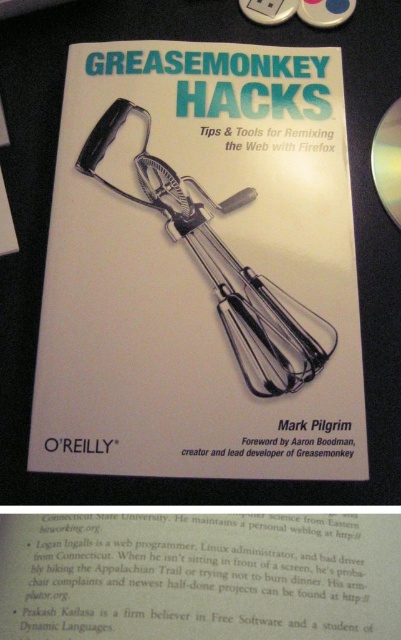
Question: Is white paper book at center further to camera compared to silver metallic dvd at upper right?

Choices:
 (A) no
 (B) yes

Answer: (A)

Question: Is white paper book at center to the right of silver metallic dvd at upper right from the viewer's perspective?

Choices:
 (A) no
 (B) yes

Answer: (A)

Question: Considering the relative positions of white paper book at center and silver metallic dvd at upper right in the image provided, where is white paper book at center located with respect to silver metallic dvd at upper right?

Choices:
 (A) below
 (B) above

Answer: (A)

Question: Among these points, which one is nearest to the camera?

Choices:
 (A) (52, 193)
 (B) (378, 168)

Answer: (A)